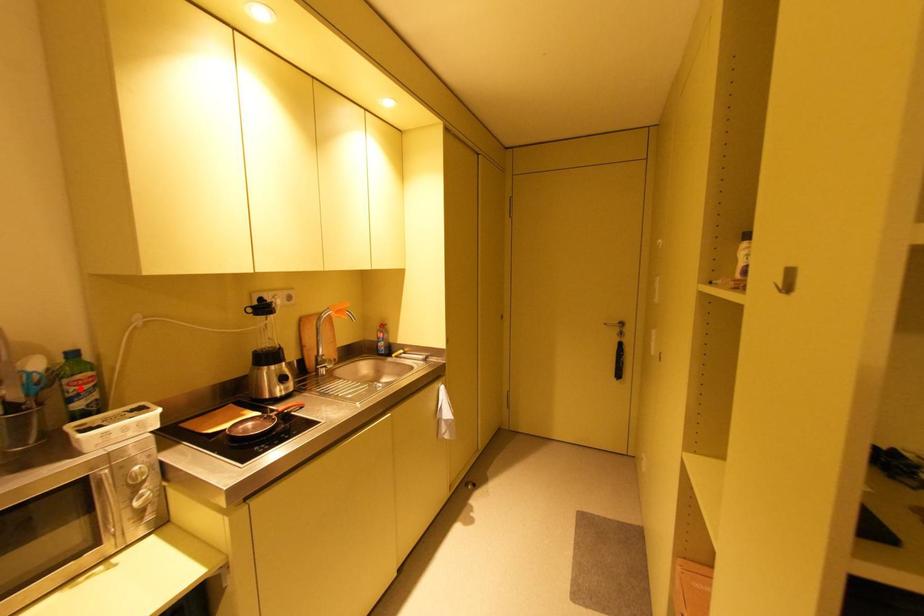
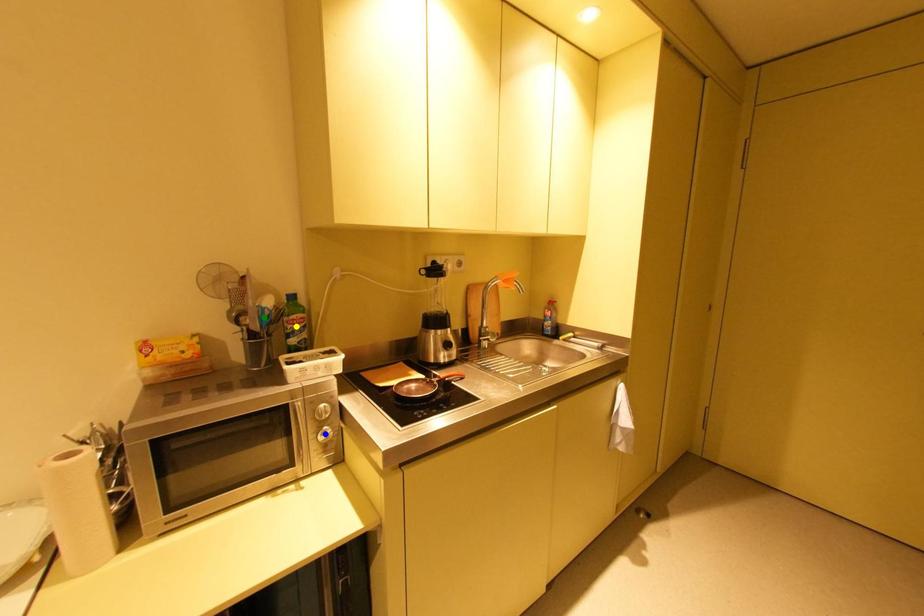
Question: I am providing you with two images of the same scene from different viewpoints. A red point is marked on the first image. You are given multiple points on the second image. Which point in image 2 is actually the same real-world point as the red point in image 1?

Choices:
 (A) yellow point
 (B) blue point
 (C) green point

Answer: (A)